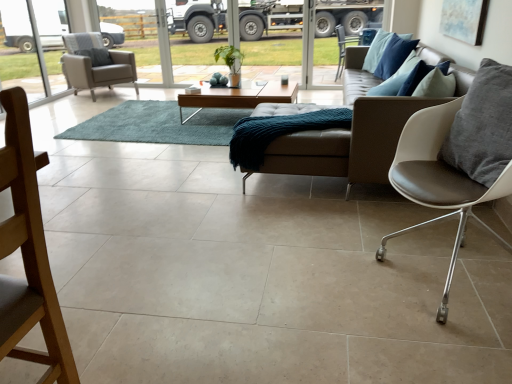
The height and width of the screenshot is (384, 512). Describe the element at coordinates (278, 132) in the screenshot. I see `teal soft fabric blanket at center` at that location.

What do you see at coordinates (239, 97) in the screenshot?
I see `light brown wooden coffee table at center` at bounding box center [239, 97].

Image resolution: width=512 pixels, height=384 pixels. I want to click on white leather chair at right, acting as the third chair starting from the left, so click(x=458, y=157).

What do you see at coordinates (348, 143) in the screenshot? The height and width of the screenshot is (384, 512). I see `leather couch at center` at bounding box center [348, 143].

Find the location of a particular element. teal soft fabric blanket at center is located at coordinates (278, 132).

From a real-world perspective, is white leather chair at right, positioned as the 2th chair in back-to-front order, below wooden chair at lower left, which is the 1th chair from bottom to top?

Yes, from a real-world perspective, white leather chair at right, positioned as the 2th chair in back-to-front order, is below wooden chair at lower left, which is the 1th chair from bottom to top.

In terms of width, does white leather chair at right, the second chair in the front-to-back sequence, look wider or thinner when compared to wooden chair at lower left, which ranks as the third chair in back-to-front order?

In the image, white leather chair at right, the second chair in the front-to-back sequence, appears to be wider than wooden chair at lower left, which ranks as the third chair in back-to-front order.

Is white leather chair at right, the 2th chair from the bottom, not close to wooden chair at lower left, which appears as the second chair when viewed from the left?

Absolutely, white leather chair at right, the 2th chair from the bottom, is distant from wooden chair at lower left, which appears as the second chair when viewed from the left.

Which is more to the right, white leather chair at right, the 1th chair viewed from the right, or wooden chair at lower left, which appears as the second chair when viewed from the left?

white leather chair at right, the 1th chair viewed from the right, is more to the right.

Which object is closer to the camera taking this photo, teal soft fabric blanket at center or leather couch at center?

leather couch at center.

Is teal soft fabric blanket at center facing away from leather couch at center?

Result: Yes, teal soft fabric blanket at center is positioned with its back facing leather couch at center.

Which is correct: teal soft fabric blanket at center is inside leather couch at center, or outside of it?

The correct answer is: inside.

Does teal soft fabric blanket at center touch leather couch at center?

There is a gap between teal soft fabric blanket at center and leather couch at center.

Would you say white leather chair at right, the 2th chair in the top-to-bottom sequence, contains light gray fabric armchair at left, the first chair from the back?

That's incorrect, light gray fabric armchair at left, the first chair from the back, is not inside white leather chair at right, the 2th chair in the top-to-bottom sequence.

From the image's perspective, is white leather chair at right, the 1th chair viewed from the right, on top of light gray fabric armchair at left, the third chair viewed from the front?

No.

Between white leather chair at right, positioned as the 2th chair in back-to-front order, and light gray fabric armchair at left, the 1th chair from the left, which one has more height?

white leather chair at right, positioned as the 2th chair in back-to-front order.

Is the surface of matte blue painting at upper right in direct contact with wooden chair at lower left, the first chair from the front?

No, matte blue painting at upper right is not making contact with wooden chair at lower left, the first chair from the front.

Is matte blue painting at upper right to the left or to the right of wooden chair at lower left, the second chair viewed from the right, in the image?

matte blue painting at upper right is to the right of wooden chair at lower left, the second chair viewed from the right.

Would you say matte blue painting at upper right is inside or outside wooden chair at lower left, which is the third chair in top-to-bottom order?

matte blue painting at upper right is not enclosed by wooden chair at lower left, which is the third chair in top-to-bottom order.

Based on the photo, who is smaller, leather couch at center or white leather chair at right, the 2th chair from the bottom?

With smaller size is white leather chair at right, the 2th chair from the bottom.

From a real-world perspective, which object stands above the other?

white leather chair at right, the 2th chair in the top-to-bottom sequence, from a real-world perspective.

Is leather couch at center located outside white leather chair at right, the 2th chair in the top-to-bottom sequence?

leather couch at center is positioned outside white leather chair at right, the 2th chair in the top-to-bottom sequence.

Where is `studio couch behind the white leather chair at right, the second chair in the front-to-back sequence`? The width and height of the screenshot is (512, 384). studio couch behind the white leather chair at right, the second chair in the front-to-back sequence is located at coordinates (348, 143).

Is gray leather pillow at right in front of or behind light gray fabric chair at left in the image?

In the image, gray leather pillow at right appears in front of light gray fabric chair at left.

From a real-world perspective, is gray leather pillow at right above or below light gray fabric chair at left?

Clearly, from a real-world perspective, gray leather pillow at right is above light gray fabric chair at left.

Would you say gray leather pillow at right is a long distance from light gray fabric chair at left?

Absolutely, gray leather pillow at right is distant from light gray fabric chair at left.

From the picture: How many degrees apart are the facing directions of gray leather pillow at right and light gray fabric chair at left?

69.5 degrees.

Does gray leather pillow at right have a greater width compared to light gray fabric armchair at left, the 1th chair in the top-to-bottom sequence?

No.

From a real-world perspective, relative to light gray fabric armchair at left, the 1th chair from the left, is gray leather pillow at right vertically above or below?

In terms of real-world spatial position, gray leather pillow at right is above light gray fabric armchair at left, the 1th chair from the left.

Does gray leather pillow at right turn towards light gray fabric armchair at left, the first chair from the back?

No, gray leather pillow at right is not turned towards light gray fabric armchair at left, the first chair from the back.

From the image's perspective, which is above, gray leather pillow at right or light gray fabric armchair at left, the 1th chair in the top-to-bottom sequence?

light gray fabric armchair at left, the 1th chair in the top-to-bottom sequence, from the image's perspective.

This screenshot has height=384, width=512. Identify the location of chair positioned vertically above the white leather chair at right, the 1th chair viewed from the right (from a real-world perspective). (28, 253).

Where is `blanket lying behind the leather couch at center`? The height and width of the screenshot is (384, 512). blanket lying behind the leather couch at center is located at coordinates (278, 132).

Considering their positions, is gray leather pillow at right positioned closer to light gray fabric armchair at left, the first chair from the back, than teal shaggy rug at center?

Based on the image, teal shaggy rug at center appears to be nearer to light gray fabric armchair at left, the first chair from the back.

Which object lies further to the anchor point matte blue painting at upper right, wooden chair at lower left, the second chair viewed from the right, or light gray fabric armchair at left, the third chair when ordered from right to left?

The object further to matte blue painting at upper right is light gray fabric armchair at left, the third chair when ordered from right to left.

From the image, which object appears to be nearer to matte blue painting at upper right, white leather chair at right, positioned as the 2th chair in back-to-front order, or light gray fabric armchair at left, the first chair from the back?

white leather chair at right, positioned as the 2th chair in back-to-front order, lies closer to matte blue painting at upper right than the other object.

Based on their spatial positions, is light gray fabric chair at left or teal soft fabric blanket at center further from leather couch at center?

light gray fabric chair at left is further to leather couch at center.

Based on their spatial positions, is matte blue painting at upper right or white leather chair at right, the 1th chair viewed from the right, further from light brown wooden coffee table at center?

The object further to light brown wooden coffee table at center is white leather chair at right, the 1th chair viewed from the right.

Based on their spatial positions, is leather couch at center or gray leather pillow at right closer to matte blue painting at upper right?

leather couch at center is closer to matte blue painting at upper right.

From the image, which object appears to be nearer to gray leather pillow at right, leather couch at center or wooden chair at lower left, which is the 1th chair from bottom to top?

Among the two, leather couch at center is located nearer to gray leather pillow at right.

Looking at the image, which one is located closer to gray leather pillow at right, light brown wooden coffee table at center or teal soft fabric blanket at center?

The object closer to gray leather pillow at right is teal soft fabric blanket at center.

Find the location of a particular element. The image size is (512, 384). pillow between light gray fabric armchair at left, the 1th chair from the left, and matte blue painting at upper right, in the horizontal direction is located at coordinates (483, 126).

The image size is (512, 384). I want to click on chair between leather couch at center and light gray fabric chair at left in the front-back direction, so click(95, 64).

Locate an element on the screen. The height and width of the screenshot is (384, 512). coffee table between wooden chair at lower left, the second chair viewed from the right, and light gray fabric chair at left in the front-back direction is located at coordinates (239, 97).

The width and height of the screenshot is (512, 384). Identify the location of mat between wooden chair at lower left, which is the 1th chair from bottom to top, and light brown wooden coffee table at center from front to back. (157, 125).